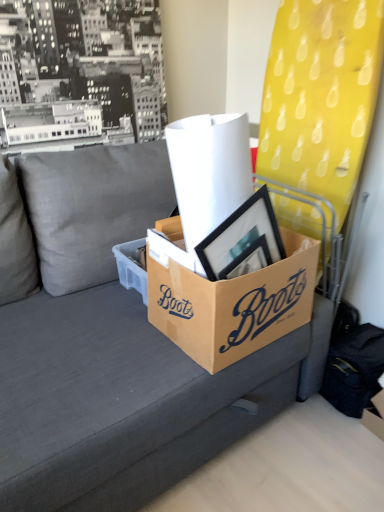
Question: Considering the relative sizes of gray fabric couch at center and brown cardboard box at center, the second box when ordered from right to left, in the image provided, is gray fabric couch at center smaller than brown cardboard box at center, the second box when ordered from right to left,?

Choices:
 (A) no
 (B) yes

Answer: (A)

Question: From the image's perspective, is gray fabric couch at center on top of brown cardboard box at center, the first box from the left?

Choices:
 (A) yes
 (B) no

Answer: (B)

Question: Can you confirm if gray fabric couch at center is positioned to the right of brown cardboard box at center, the second box when ordered from right to left?

Choices:
 (A) yes
 (B) no

Answer: (B)

Question: From a real-world perspective, is gray fabric couch at center under brown cardboard box at center, the first box from the left?

Choices:
 (A) no
 (B) yes

Answer: (B)

Question: Does gray fabric couch at center have a greater width compared to brown cardboard box at center, the second box when ordered from right to left?

Choices:
 (A) no
 (B) yes

Answer: (B)

Question: Is gray fabric couch at center oriented towards brown cardboard box at center, the first box from the left?

Choices:
 (A) no
 (B) yes

Answer: (B)

Question: Are gray fabric couch at center and white paper at center beside each other?

Choices:
 (A) no
 (B) yes

Answer: (A)

Question: Is gray fabric couch at center not close to white paper at center?

Choices:
 (A) yes
 (B) no

Answer: (B)

Question: Can you confirm if gray fabric couch at center is positioned to the right of white paper at center?

Choices:
 (A) no
 (B) yes

Answer: (A)

Question: Is gray fabric couch at center facing away from white paper at center?

Choices:
 (A) yes
 (B) no

Answer: (B)

Question: Could you tell me if gray fabric couch at center is facing white paper at center?

Choices:
 (A) yes
 (B) no

Answer: (B)

Question: Can you confirm if gray fabric couch at center is shorter than white paper at center?

Choices:
 (A) no
 (B) yes

Answer: (A)

Question: Can we say gray fabric couch at center lies outside brown cardboard box at center, the 2th box when ordered from left to right?

Choices:
 (A) yes
 (B) no

Answer: (A)